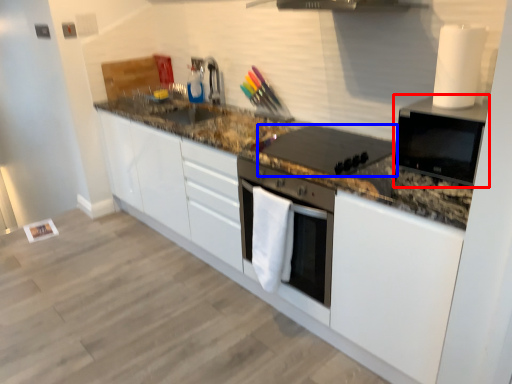
Question: Which object appears farthest to the camera in this image, home appliance (highlighted by a red box) or kitchen appliance (highlighted by a blue box)?

Choices:
 (A) home appliance
 (B) kitchen appliance

Answer: (B)